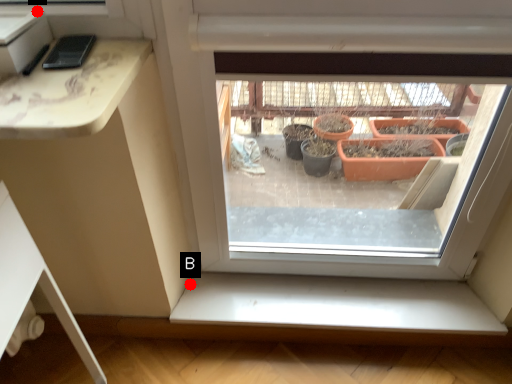
Question: Two points are circled on the image, labeled by A and B beside each circle. Which point is further to the camera?

Choices:
 (A) A is further
 (B) B is further

Answer: (B)